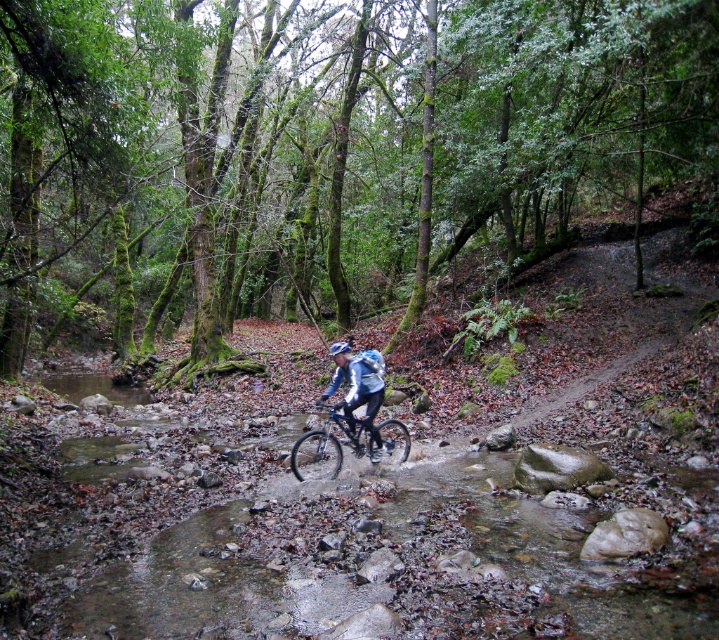
Describe the element at coordinates (360, 390) in the screenshot. I see `matte blue jacket at center` at that location.

Based on the photo, does matte blue jacket at center have a larger size compared to matte blue helmet at center?

Incorrect, matte blue jacket at center is not larger than matte blue helmet at center.

Who is more distant from viewer, (349, 362) or (334, 342)?

Point (334, 342)

You are a GUI agent. You are given a task and a screenshot of the screen. Output one action in this format:
    pyautogui.click(x=<x>, y=<y>)
    Task: Click on the matte blue jacket at center
    This screenshot has height=640, width=719.
    Given the screenshot: What is the action you would take?
    pyautogui.click(x=360, y=390)

Measure the distance from shiny metallic bicycle at center to matte blue jacket at center.

35.55 inches

Is point (336, 470) positioned after point (342, 368)?

Yes, it is.

Where is `shiny metallic bicycle at center`? shiny metallic bicycle at center is located at coordinates (329, 445).

From the picture: Can you confirm if green mossy trees at center is positioned to the right of matte blue jacket at center?

No, green mossy trees at center is not to the right of matte blue jacket at center.

Is point (123, 128) closer to camera compared to point (339, 362)?

No, it is not.

This screenshot has width=719, height=640. Identify the location of green mossy trees at center. (331, 154).